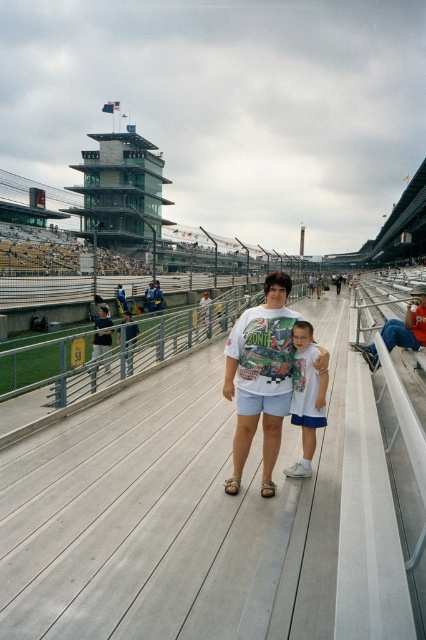
Question: Can you confirm if dark blue shirt at center is positioned below blue denim jeans at center?

Choices:
 (A) no
 (B) yes

Answer: (B)

Question: Is denim shorts at lower right bigger than dark blue shirt at center?

Choices:
 (A) yes
 (B) no

Answer: (B)

Question: Which of the following is the closest to the observer?

Choices:
 (A) (261, 320)
 (B) (374, 364)
 (C) (293, 346)

Answer: (A)

Question: Which of the following is the farthest from the observer?

Choices:
 (A) (419, 330)
 (B) (308, 381)

Answer: (A)

Question: Is white cotton shirt at center bigger than blue denim jeans at center?

Choices:
 (A) no
 (B) yes

Answer: (A)

Question: Which of the following is the farthest from the observer?

Choices:
 (A) dark blue shirt at center
 (B) white cotton t-shirt at center

Answer: (A)